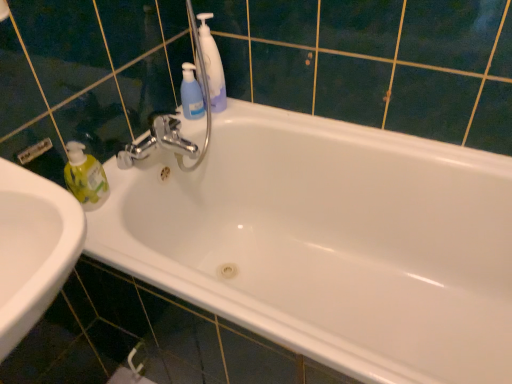
Question: Is white glossy bathtub at center wider or thinner than translucent blue pump bottle at upper center?

Choices:
 (A) wide
 (B) thin

Answer: (A)

Question: In terms of height, does white glossy bathtub at center look taller or shorter compared to translucent blue pump bottle at upper center?

Choices:
 (A) short
 (B) tall

Answer: (B)

Question: Which of these objects is positioned farthest from the blue translucent bottle at upper center?

Choices:
 (A) translucent blue pump bottle at upper center
 (B) white glossy bathtub at center

Answer: (B)

Question: Which object is the closest to the translucent blue pump bottle at upper center?

Choices:
 (A) blue translucent bottle at upper center
 (B) white glossy bathtub at center

Answer: (A)